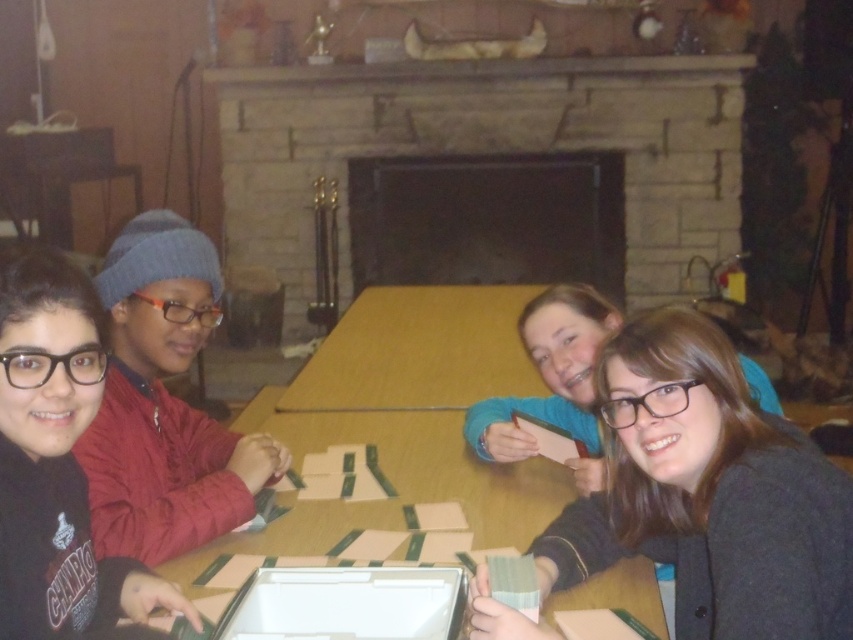
Does stone fireplace at center appear on the right side of black matte beanie at left?

Correct, you'll find stone fireplace at center to the right of black matte beanie at left.

Does stone fireplace at center have a lesser height compared to black matte beanie at left?

No, stone fireplace at center is not shorter than black matte beanie at left.

Between point (422, 120) and point (96, 410), which one is positioned in front?

Point (96, 410) is more forward.

Where is `stone fireplace at center`? The image size is (853, 640). stone fireplace at center is located at coordinates (483, 148).

Is red fleece jacket at left to the left of black matte beanie at left from the viewer's perspective?

Yes, red fleece jacket at left is to the left of black matte beanie at left.

Is red fleece jacket at left to the right of black matte beanie at left from the viewer's perspective?

No, red fleece jacket at left is not to the right of black matte beanie at left.

Locate an element on the screen. This screenshot has width=853, height=640. red fleece jacket at left is located at coordinates (164, 403).

You are a GUI agent. You are given a task and a screenshot of the screen. Output one action in this format:
    pyautogui.click(x=<x>, y=<y>)
    Task: Click on the red fleece jacket at left
    
    Given the screenshot: What is the action you would take?
    pyautogui.click(x=164, y=403)

Which is behind, point (48, 282) or point (334, 371)?

The point (334, 371) is more distant.

Does black matte beanie at left lie behind brown wooden table at center?

No, it is in front of brown wooden table at center.

Locate an element on the screen. The width and height of the screenshot is (853, 640). black matte beanie at left is located at coordinates (57, 465).